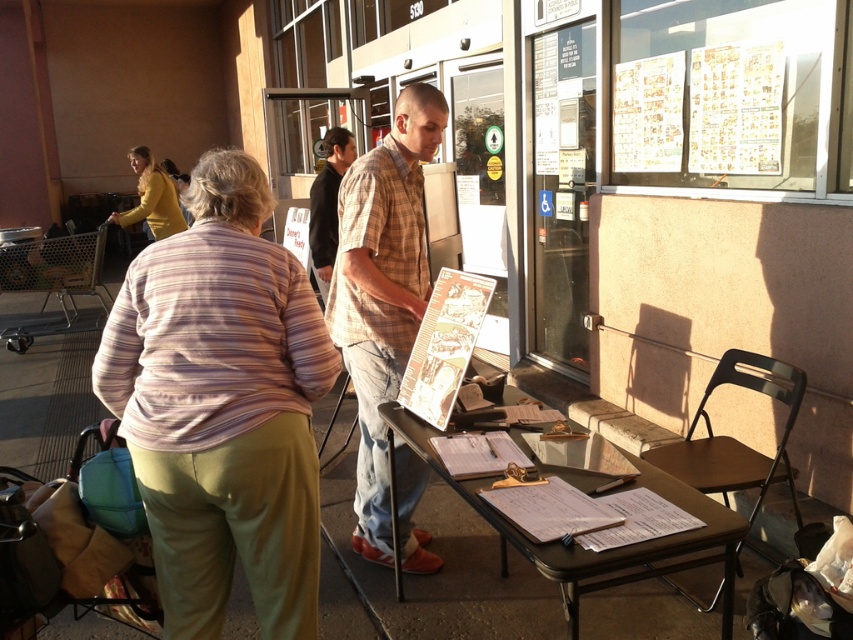
You are organizing an outdoor event and need to choose between two shirts displayed at the table. The plaid cotton shirt at center and the plaid shirt at center. Which one is taller?

The plaid cotton shirt at center is taller than the plaid shirt at center according to the description.

You are a photographer standing in front of the table and want to capture both the striped cotton shirt at left and the matte yellow sweater at upper left in the same frame. Which item will appear closer to the camera in the photo?

The striped cotton shirt at left will appear closer to the camera because it is in front of the matte yellow sweater at upper left.